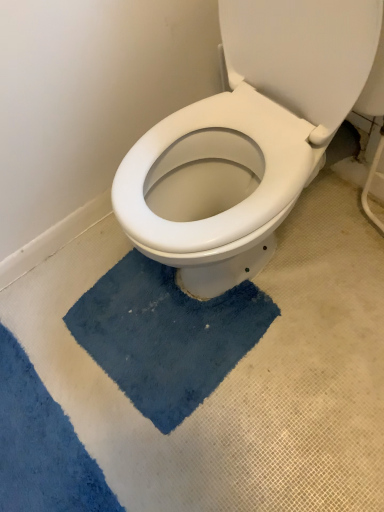
At what (x,y) coordinates should I click in order to perform the action: click on free point in front of blue plush bath mat at center, which is the second bath mat in left-to-right order. Please return your answer as a coordinate pair (x, y). Looking at the image, I should click on (225, 446).